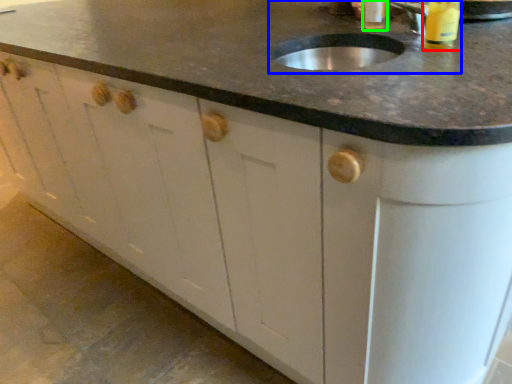
Question: Considering the real-world distances, which object is closest to beverage (highlighted by a red box)? sink (highlighted by a blue box) or beverage (highlighted by a green box).

Choices:
 (A) sink
 (B) beverage

Answer: (A)